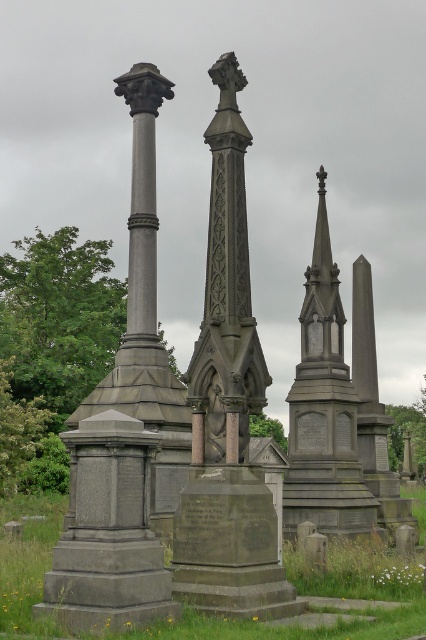
Looking at this image, you are a visitor at the cemetery and want to place a flowerpot between the gray stone monument at center and the polished stone spire at center. Which object should the flowerpot be closer to if you want it to be aligned with the narrower structure?

The gray stone monument at center is thinner than the polished stone spire at center, so the flowerpot should be placed closer to the gray stone monument at center to align with the narrower structure.